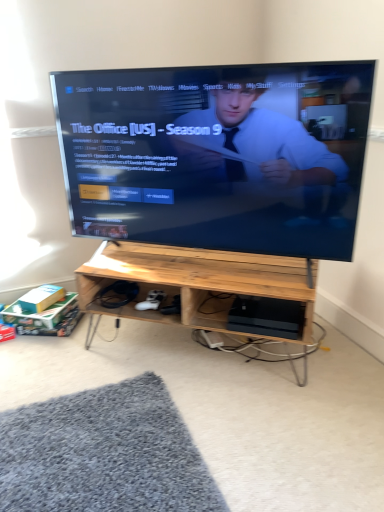
You are a GUI agent. You are given a task and a screenshot of the screen. Output one action in this format:
    pyautogui.click(x=<x>, y=<y>)
    Task: Click on the vacant area in front of natural wood desk at center
    This screenshot has height=512, width=384.
    Given the screenshot: What is the action you would take?
    (x=213, y=432)